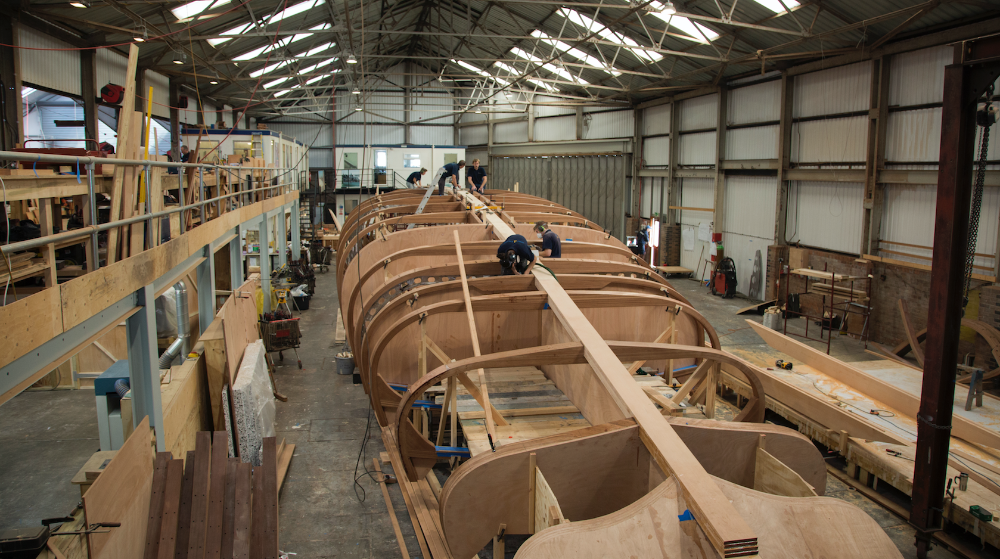
The width and height of the screenshot is (1000, 559). I want to click on floor, so click(x=333, y=503).